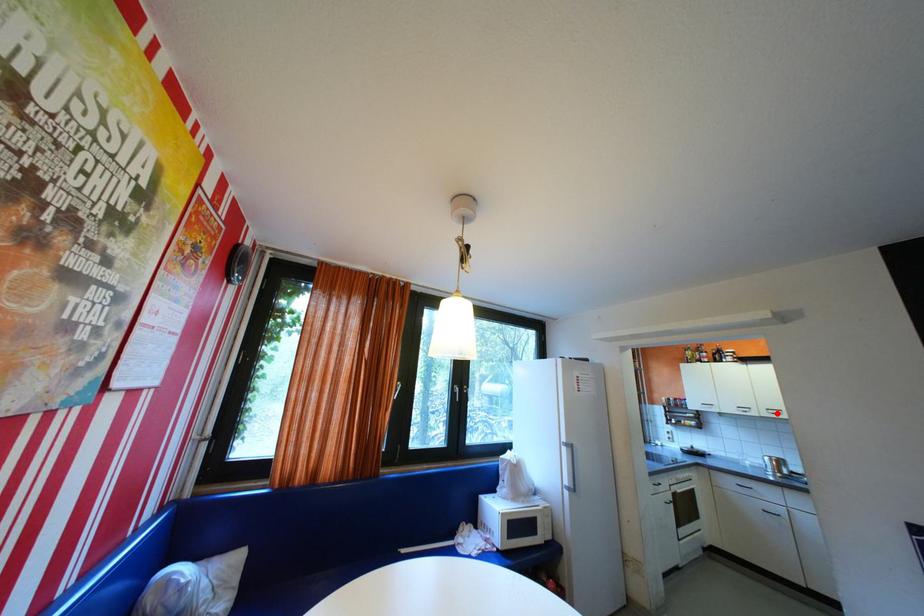
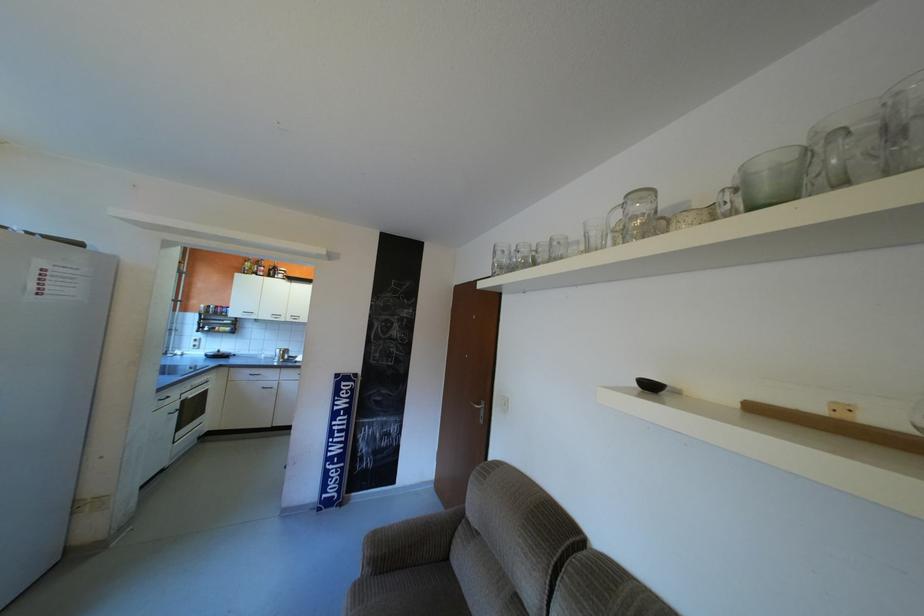
In the second image, find the point that corresponds to the highlighted location in the first image.

(300, 318)